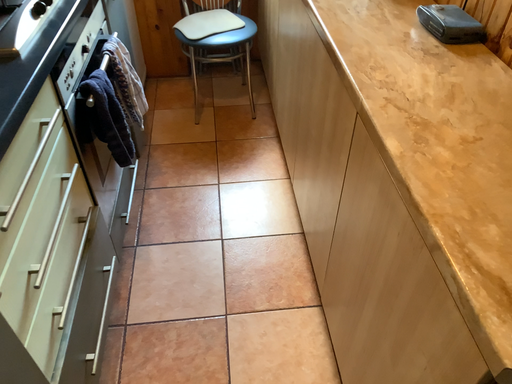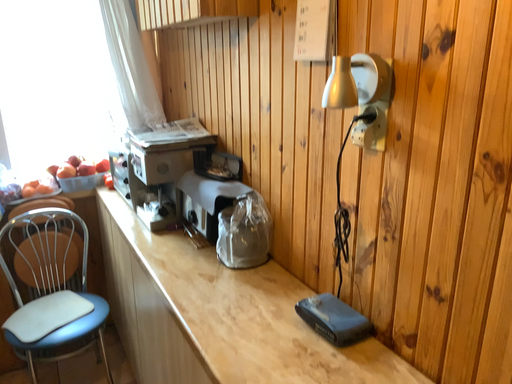
Question: How did the camera likely rotate when shooting the video?

Choices:
 (A) rotated upward
 (B) rotated downward

Answer: (A)